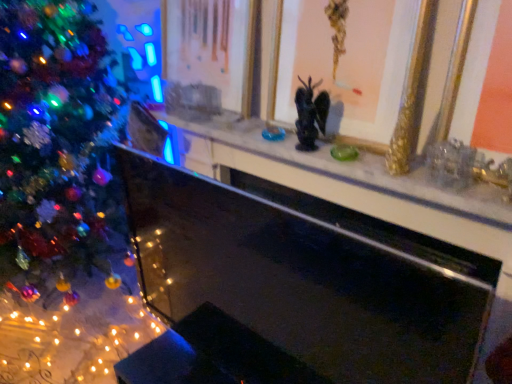
Find the location of a particular element. This screenshot has width=512, height=384. free space above marble mantel at center (from a real-world perspective) is located at coordinates (296, 135).